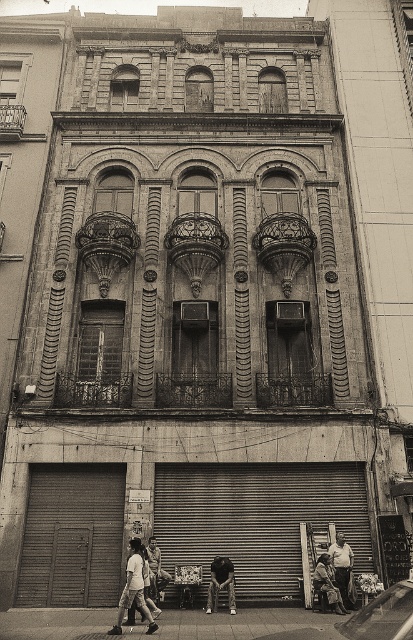
Between point (223, 573) and point (320, 556), which one is positioned in front?

Point (223, 573)

Between point (230, 589) and point (325, 556), which one is positioned behind?

Positioned behind is point (325, 556).

Describe the element at coordinates (222, 580) in the screenshot. I see `dark brown leather jacket at center` at that location.

The width and height of the screenshot is (413, 640). Identify the location of dark brown leather jacket at center. (222, 580).

Does white cotton shirt at lower center appear under dark gray fabric pants at lower center?

Actually, white cotton shirt at lower center is above dark gray fabric pants at lower center.

Can you confirm if white cotton shirt at lower center is bigger than dark gray fabric pants at lower center?

Indeed, white cotton shirt at lower center has a larger size compared to dark gray fabric pants at lower center.

The width and height of the screenshot is (413, 640). What do you see at coordinates (133, 589) in the screenshot? I see `white cotton shirt at lower center` at bounding box center [133, 589].

Find the location of `white cotton shirt at lower center`. white cotton shirt at lower center is located at coordinates point(133,589).

Which is below, wooden shuttered garage door at lower left or dark gray fabric pants at lower center?

wooden shuttered garage door at lower left

I want to click on wooden shuttered garage door at lower left, so click(73, 536).

This screenshot has width=413, height=640. Identify the location of wooden shuttered garage door at lower left. (73, 536).